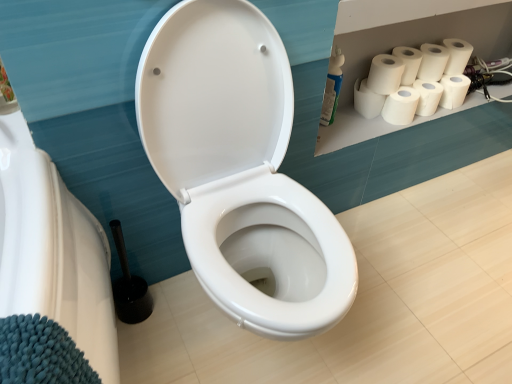
Find the location of a particular element. The image size is (512, 384). vacant space situated on the left part of white matte paper towel at upper right, which is the fourth paper towel from right to left is located at coordinates (357, 125).